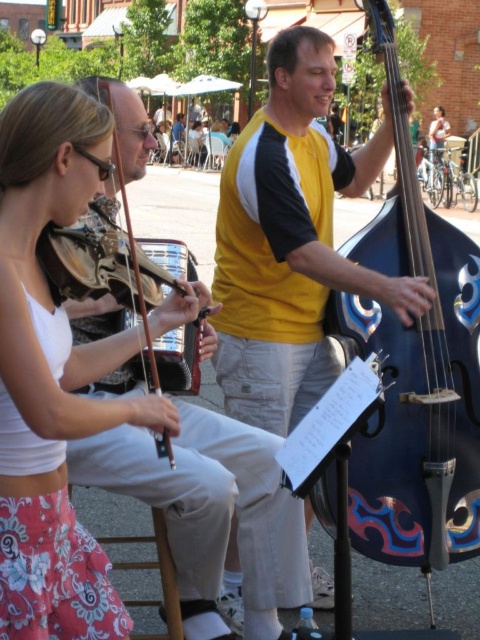
You are a photographer standing in the middle of the street, and you want to take a photo of the yellow jersey at center and the blue painted wood cello at center. Which object should you focus on first if you want to capture both in the frame without moving the camera?

The yellow jersey at center is taller than the blue painted wood cello at center, so you should focus on the yellow jersey at center first to ensure it fits within the frame.

Based on the photo, you are a photographer standing in the scene and want to capture both the yellow jersey at center and the matte brown violin at left in a single frame. Considering their heights, which object should you focus on first to ensure both are fully visible in the photo?

The yellow jersey at center is taller than the matte brown violin at left. To ensure both are fully visible, focus on the taller object first, which is the yellow jersey at center, as it requires more vertical space in the frame.